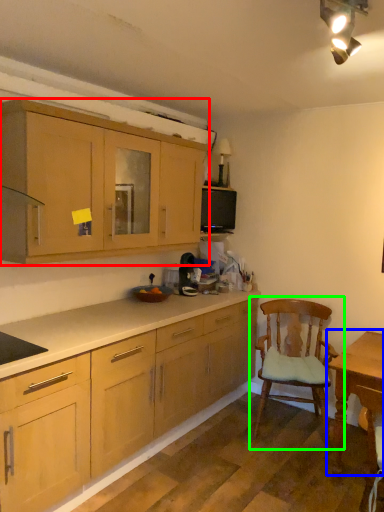
Question: Based on their relative distances, which object is farther from cabinetry (highlighted by a red box)? Choose from table (highlighted by a blue box) and chair (highlighted by a green box).

Choices:
 (A) table
 (B) chair

Answer: (A)